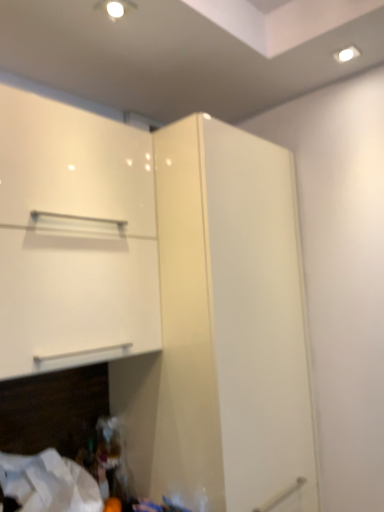
Question: Can you confirm if white glossy cabinet at upper left is wider than glossy white cupboard at upper center?

Choices:
 (A) no
 (B) yes

Answer: (B)

Question: From a real-world perspective, is white glossy cabinet at upper left located beneath glossy white cupboard at upper center?

Choices:
 (A) yes
 (B) no

Answer: (B)

Question: Is glossy white cupboard at upper center at the back of white glossy cabinet at upper left?

Choices:
 (A) no
 (B) yes

Answer: (B)

Question: Is white glossy cabinet at upper left bigger than glossy white cupboard at upper center?

Choices:
 (A) no
 (B) yes

Answer: (B)

Question: Considering the relative sizes of white glossy cabinet at upper left and glossy white cupboard at upper center in the image provided, is white glossy cabinet at upper left shorter than glossy white cupboard at upper center?

Choices:
 (A) no
 (B) yes

Answer: (B)

Question: Does white glossy cabinet at upper left have a lesser width compared to glossy white cupboard at upper center?

Choices:
 (A) yes
 (B) no

Answer: (B)

Question: Is white fabric at lower left smaller than glossy white cupboard at upper center?

Choices:
 (A) yes
 (B) no

Answer: (A)

Question: Does white fabric at lower left come behind glossy white cupboard at upper center?

Choices:
 (A) no
 (B) yes

Answer: (B)

Question: Is white fabric at lower left positioned far away from glossy white cupboard at upper center?

Choices:
 (A) yes
 (B) no

Answer: (B)

Question: From the image's perspective, is white fabric at lower left on top of glossy white cupboard at upper center?

Choices:
 (A) yes
 (B) no

Answer: (B)

Question: Can you confirm if white fabric at lower left is shorter than glossy white cupboard at upper center?

Choices:
 (A) no
 (B) yes

Answer: (B)

Question: Can you see white fabric at lower left touching glossy white cupboard at upper center?

Choices:
 (A) yes
 (B) no

Answer: (B)

Question: Is glossy white cupboard at upper center bigger than white glossy cabinet at upper left?

Choices:
 (A) no
 (B) yes

Answer: (A)